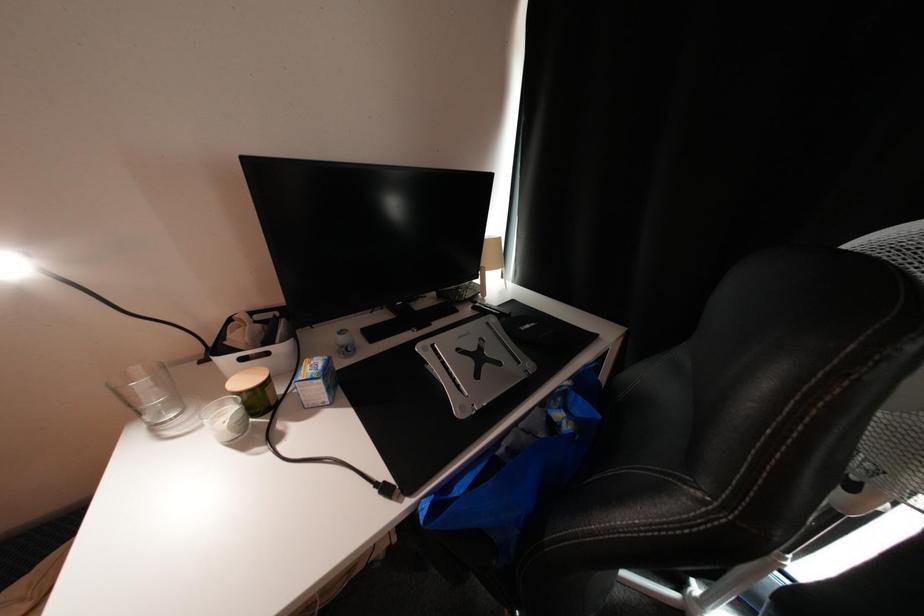
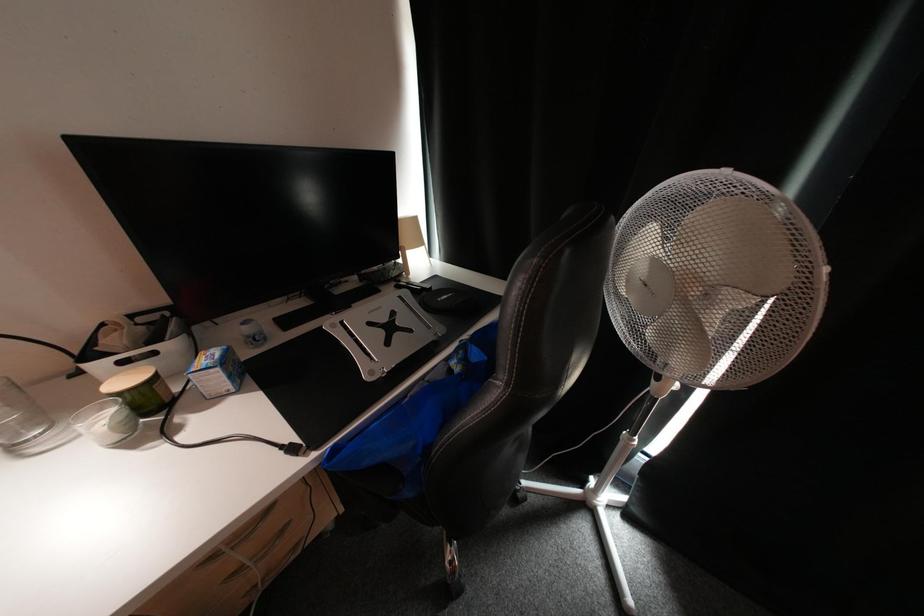
Which direction would the cameraman need to move to produce the second image?

The cameraman moved toward right, backward.